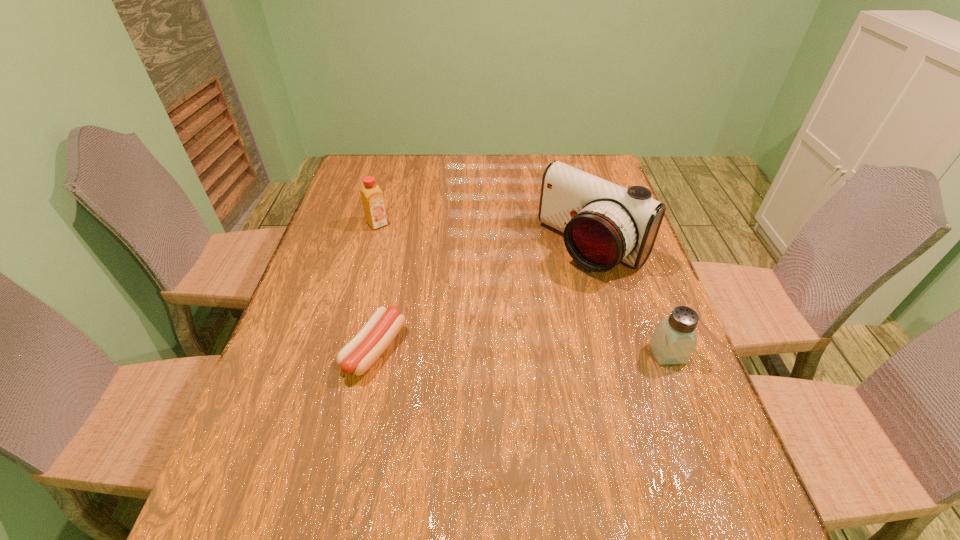
The width and height of the screenshot is (960, 540). What are the coordinates of `sausage` in the screenshot? It's located at (357, 356).

Find the location of a particular element. the second shortest object is located at coordinates 674,339.

Locate an element on the screen. Image resolution: width=960 pixels, height=540 pixels. the third shortest object is located at coordinates (372, 197).

The image size is (960, 540). Identify the location of camcorder. (603, 223).

I want to click on vacant space located 0.150m on the left of the shortest object, so click(280, 349).

I want to click on vacant space situated 0.220m on the front of the saltshaker, so click(709, 465).

Where is `vacant region located on the front and back of the orange juice`? Image resolution: width=960 pixels, height=540 pixels. vacant region located on the front and back of the orange juice is located at coordinates (430, 278).

The width and height of the screenshot is (960, 540). What are the coordinates of `vacant space located 0.280m on the front and back of the orange juice` in the screenshot? It's located at (434, 282).

Find the location of a particular element. This screenshot has width=960, height=540. vacant space located on the front and back of the orange juice is located at coordinates 409,256.

The height and width of the screenshot is (540, 960). I want to click on free space located on the surface of the tallest object, so click(499, 338).